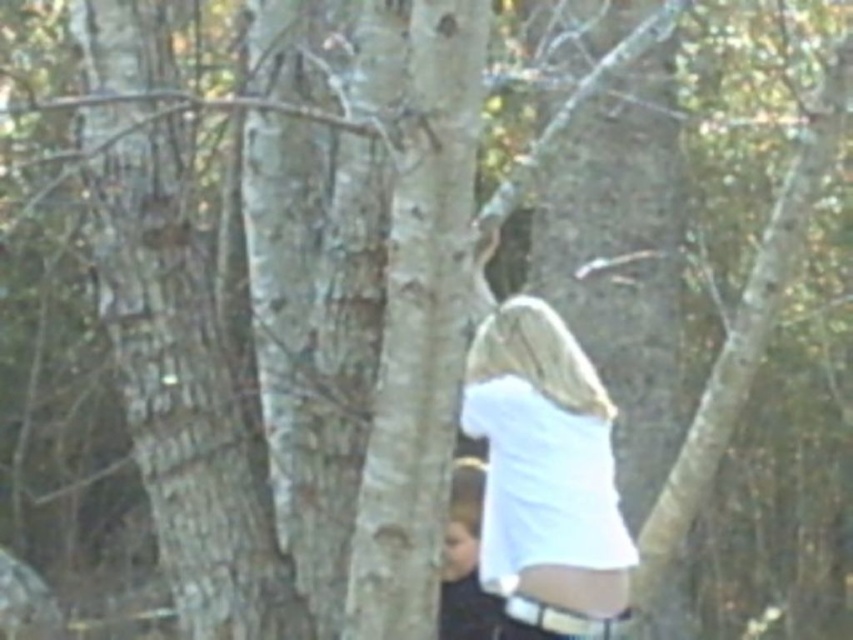
Question: Among these objects, which one is farthest from the camera?

Choices:
 (A) white matte shirt at center
 (B) white fabric at lower right

Answer: (B)

Question: Which object is positioned closest to the white matte shirt at center?

Choices:
 (A) white fabric at lower right
 (B) white smooth tree trunk at center

Answer: (A)

Question: Does white matte shirt at center have a greater width compared to white fabric at lower right?

Choices:
 (A) yes
 (B) no

Answer: (A)

Question: Is white smooth tree trunk at center bigger than white matte shirt at center?

Choices:
 (A) yes
 (B) no

Answer: (A)

Question: Which object is positioned farthest from the white fabric at lower right?

Choices:
 (A) white smooth tree trunk at center
 (B) white matte shirt at center

Answer: (A)

Question: Can you confirm if white smooth tree trunk at center is positioned to the left of white fabric at lower right?

Choices:
 (A) yes
 (B) no

Answer: (A)